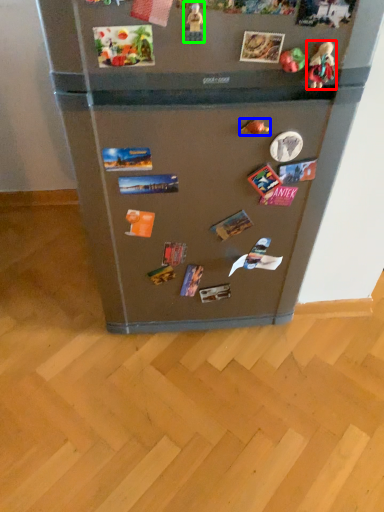
Question: Considering the real-world distances, which object is closest to toy (highlighted by a red box)? toy (highlighted by a blue box) or toy (highlighted by a green box).

Choices:
 (A) toy
 (B) toy

Answer: (A)